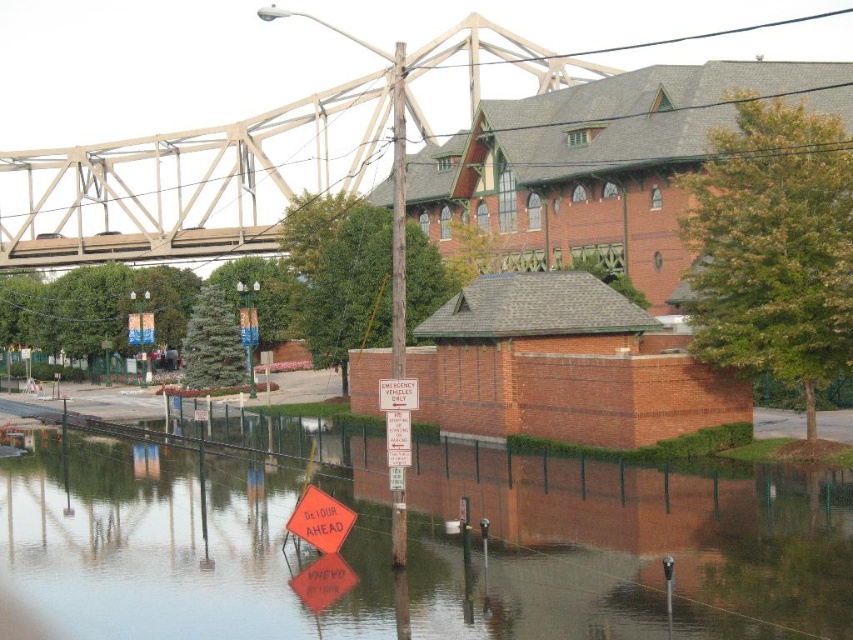
You are a delivery drone operator who needs to fly a drone from the metallic gray bridge at upper center to deliver a package to a location near the translucent plastic water at lower center. The drone has a maximum flight range of 50 meters. Can the drone reach the destination without needing to recharge?

The translucent plastic water at lower center is 60.95 meters away from the metallic gray bridge at upper center. Since the drone can only fly 50 meters before needing to recharge, it cannot reach the destination without recharging.

You are a delivery drone operator trying to navigate through the flooded area. Your drone has a limited flight path. You see the translucent plastic water at lower center and the metallic gray bridge at upper center. Which object is closer to your current position?

The translucent plastic water at lower center is closer to your current position because it is in front of the metallic gray bridge at upper center.

Consider the image. You are a delivery driver trying to navigate through the flooded area. You see the translucent plastic water at lower center and the metallic gray bridge at upper center. Which one is higher in elevation?

The metallic gray bridge at upper center is higher in elevation than the translucent plastic water at lower center because the water is not as tall as the bridge.